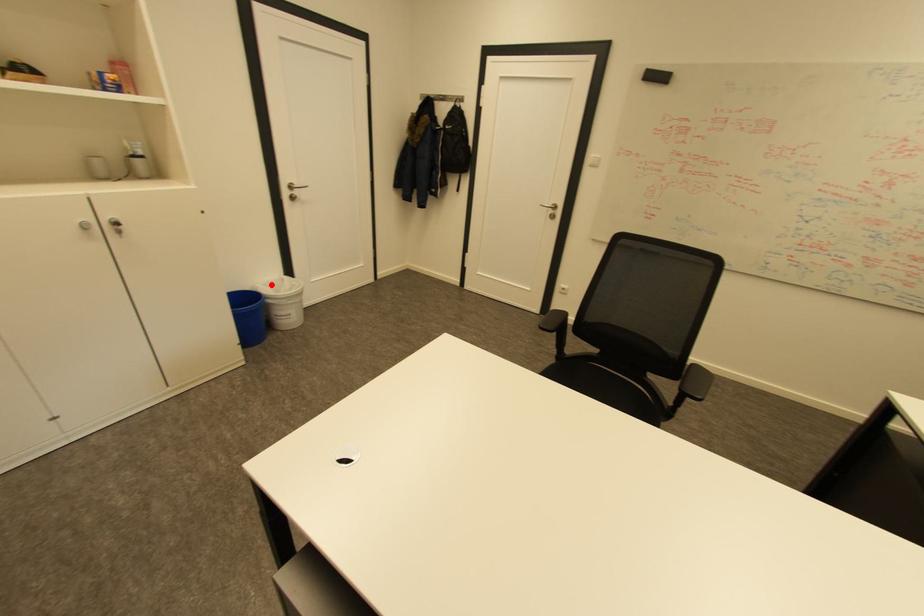
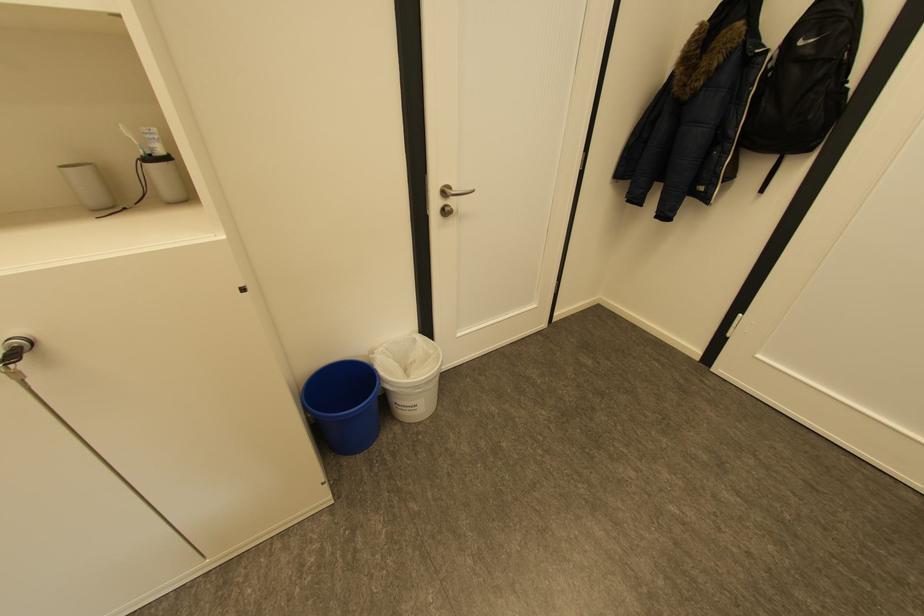
Question: I am providing you with two images of the same scene from different viewpoints. Given a red point in image1, look at the same physical point in image2. Is it:

Choices:
 (A) Closer to the viewpoint
 (B) Farther from the viewpoint

Answer: (B)